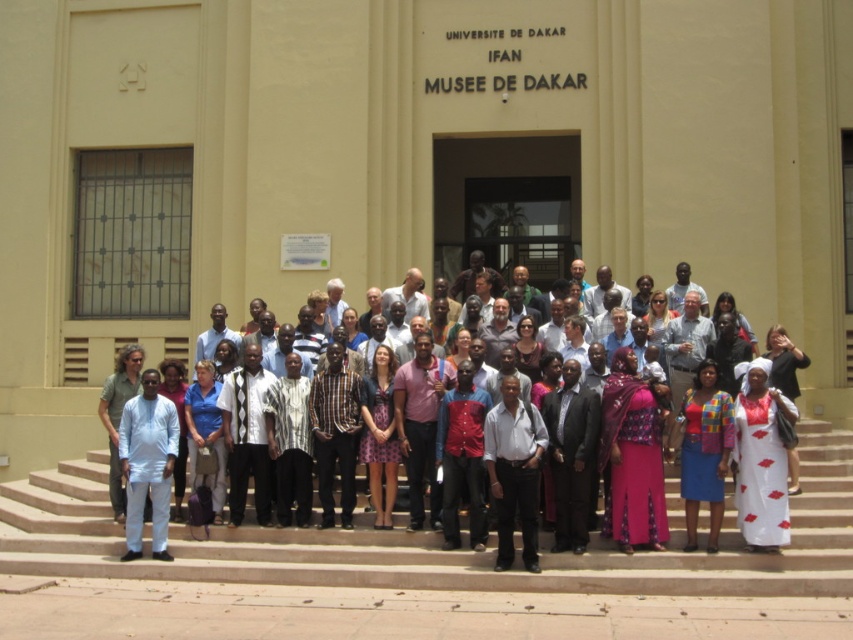
The beige concrete stairs at center is located at point (437, 544). If you are standing at point 0.700, 0.600, which direction should you move to reach the beige concrete stairs at center?

To reach the beige concrete stairs at center located at point (437, 544) from your current position at 0.700, 0.600, you should move northeast. This is because the stairs are positioned to the northeast relative to your current location.

You are a photographer standing in front of the building. You want to capture a photo where the matte white shirt at center is clearly visible above the beige concrete stairs at center. Based on the scene description, is this possible?

Yes, the matte white shirt at center has a greater height compared to the beige concrete stairs at center, so it will be visible above them in the photo.

You are standing in front of the Universite de Dakar Ifan Musee de Dakar building and see a group of people. Among them, there is a white printed dress at center and a light blue fabric shirt at center. Which of these two items is positioned closer to you?

The white printed dress at center is closer to the viewer than the light blue fabric shirt at center.